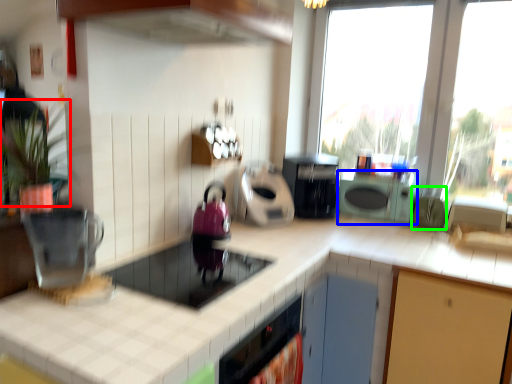
Question: Which object is positioned farthest from plant (highlighted by a red box)? Select from cabinetry (highlighted by a blue box) and appliance (highlighted by a green box).

Choices:
 (A) cabinetry
 (B) appliance

Answer: (B)